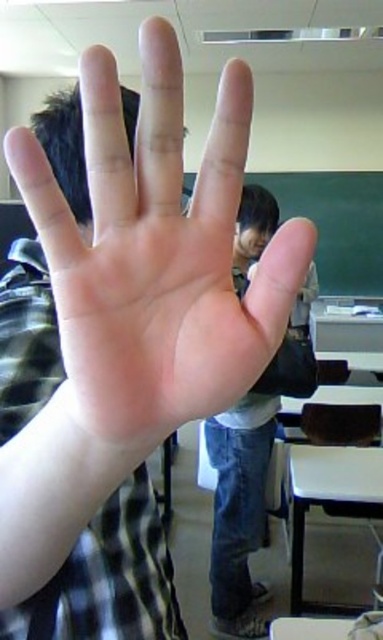
Question: Which of the following is the farthest from the observer?

Choices:
 (A) jeans at center
 (B) smooth skin palm at center

Answer: (A)

Question: Is smooth skin palm at center to the right of jeans at center from the viewer's perspective?

Choices:
 (A) no
 (B) yes

Answer: (A)

Question: Is smooth skin palm at center thinner than jeans at center?

Choices:
 (A) no
 (B) yes

Answer: (B)

Question: Considering the relative positions of smooth skin palm at center and jeans at center in the image provided, where is smooth skin palm at center located with respect to jeans at center?

Choices:
 (A) below
 (B) above

Answer: (B)